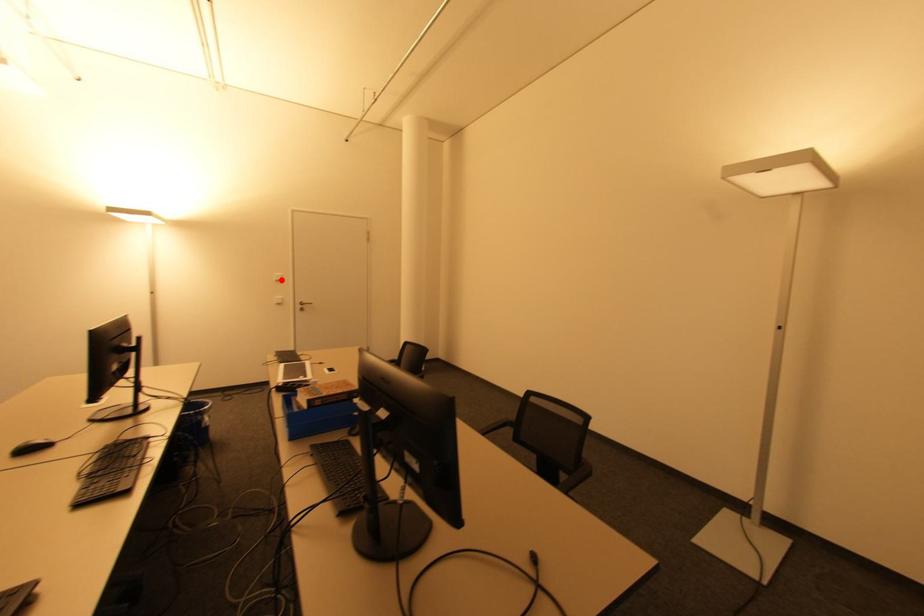
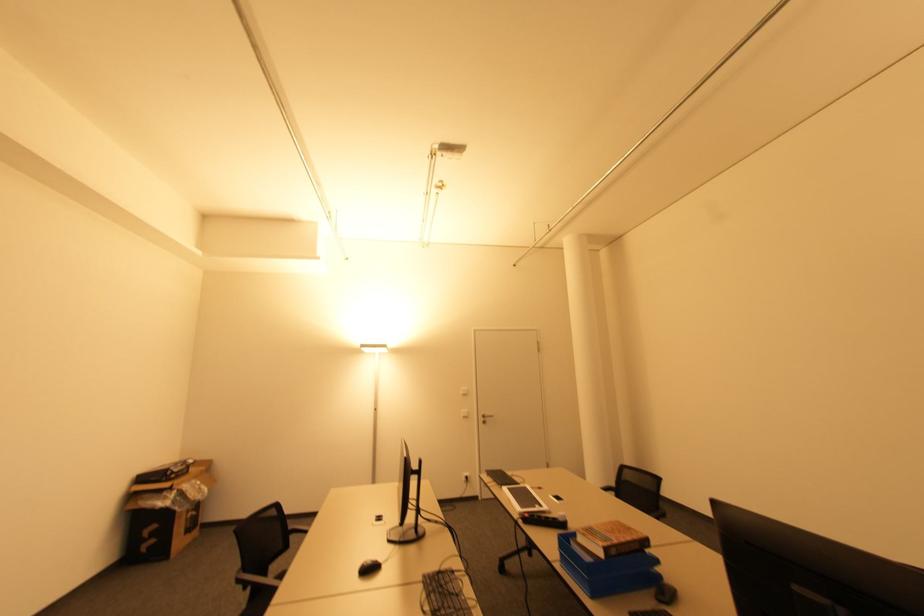
Find the pixel in the second image that matches the highlighted location in the first image.

(468, 392)